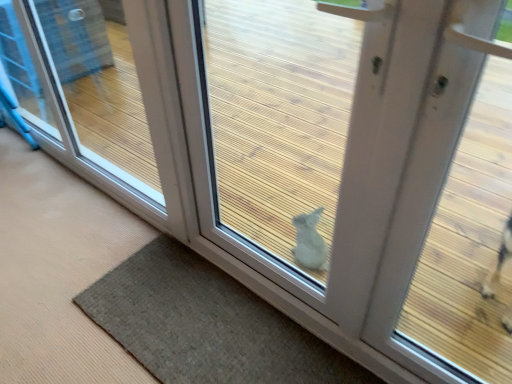
Question: Is point (180, 64) positioned closer to the camera than point (134, 157)?

Choices:
 (A) closer
 (B) farther

Answer: (A)

Question: From a real-world perspective, is white matte door at center positioned above or below transparent glass door at lower right?

Choices:
 (A) below
 (B) above

Answer: (B)

Question: Based on their relative distances, which object is nearer to the brown textured mat at lower center?

Choices:
 (A) transparent glass door at lower right
 (B) white matte door at center

Answer: (B)

Question: Estimate the real-world distances between objects in this image. Which object is farther from the white matte door at center?

Choices:
 (A) transparent glass door at lower right
 (B) brown textured mat at lower center

Answer: (A)